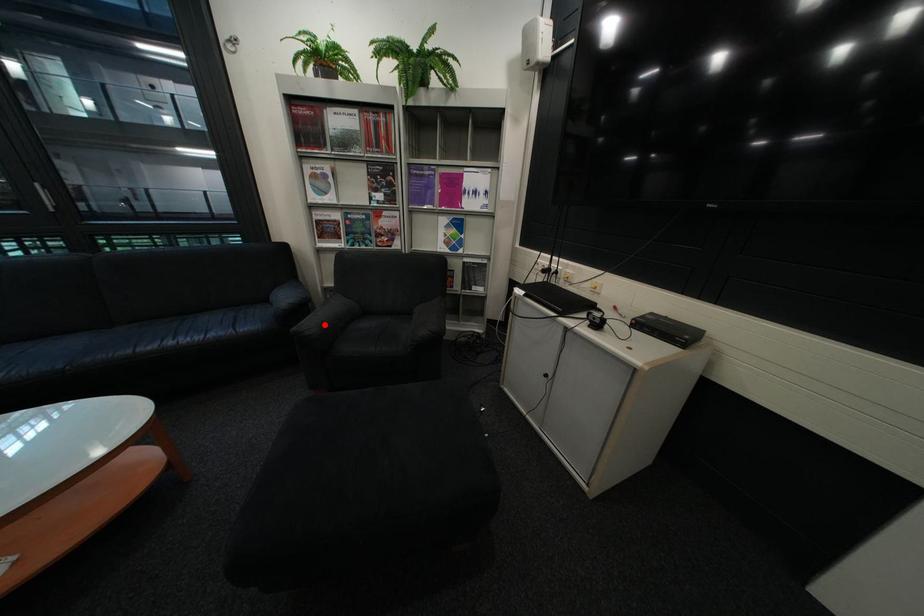
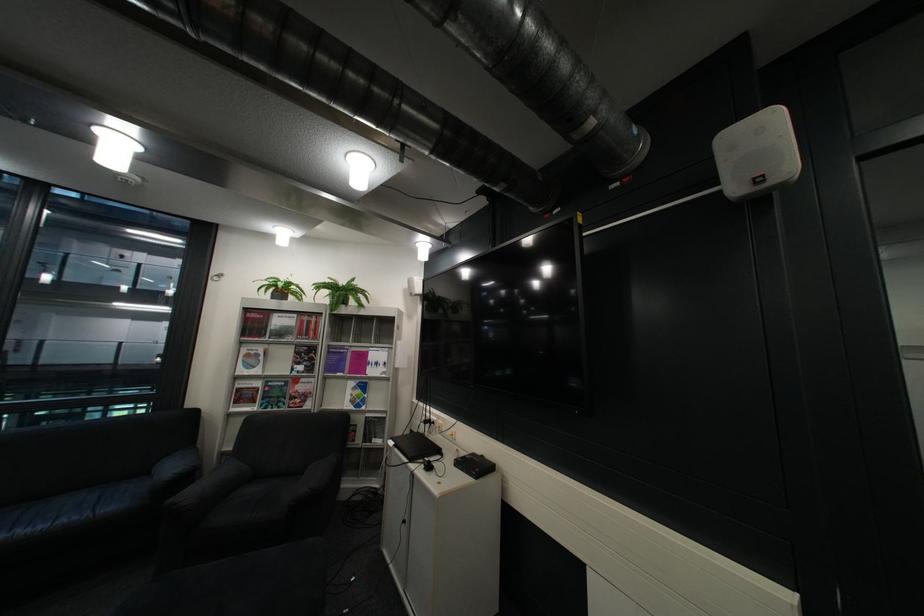
Question: A red point is marked in image1. In image2, is the corresponding 3D point closer to the camera or farther? Reply with the corresponding letter.

Choices:
 (A) The corresponding 3D point is closer.
 (B) The corresponding 3D point is farther.

Answer: (B)